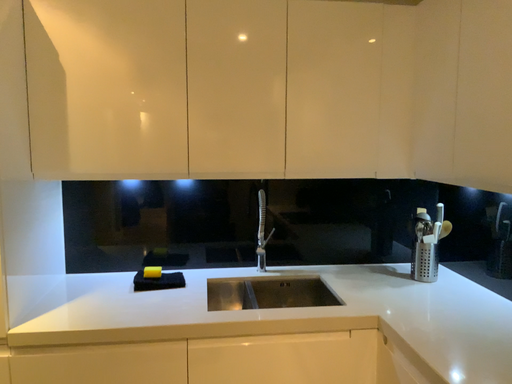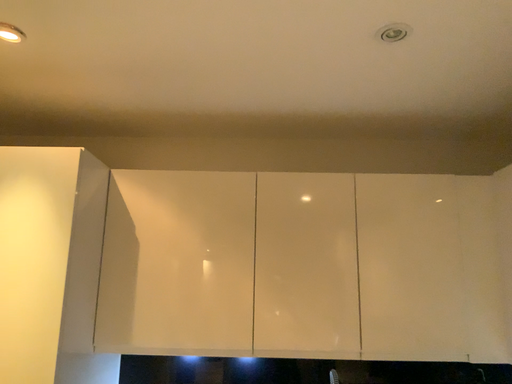
Question: How did the camera likely rotate when shooting the video?

Choices:
 (A) rotated downward
 (B) rotated upward

Answer: (B)